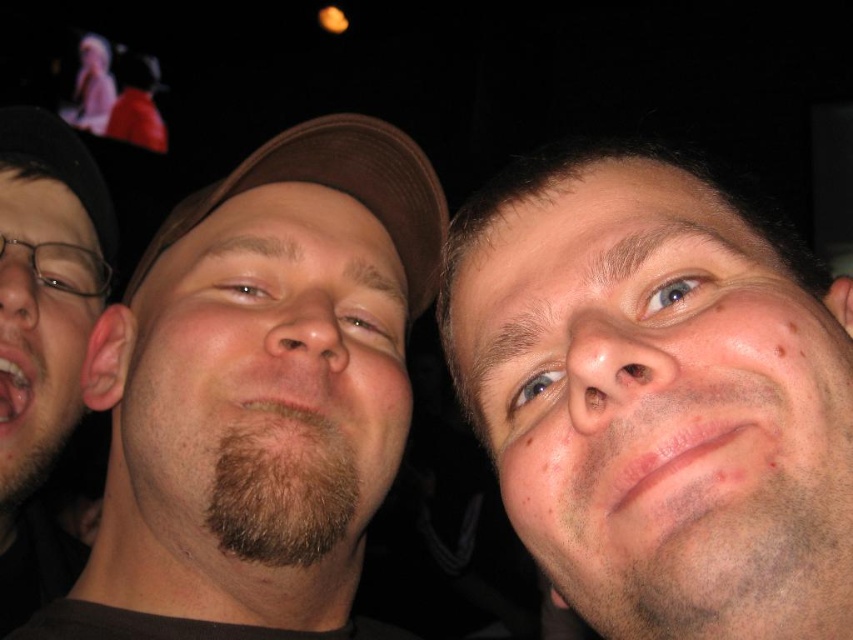
Question: Observing the image, what is the correct spatial positioning of brown matte cap at center in reference to beige matte face at left?

Choices:
 (A) right
 (B) left

Answer: (A)

Question: Can you confirm if smooth skin face at center is bigger than brown matte cap at center?

Choices:
 (A) yes
 (B) no

Answer: (B)

Question: Among these points, which one is nearest to the camera?

Choices:
 (A) (320, 168)
 (B) (718, 620)

Answer: (B)

Question: Which of the following is the farthest from the observer?

Choices:
 (A) bearded man at left
 (B) brown beard at center
 (C) beige matte face at left

Answer: (C)

Question: Which of these objects is positioned farthest from the beige matte face at left?

Choices:
 (A) bearded man at left
 (B) brown fabric baseball cap at center

Answer: (B)

Question: Can you confirm if bearded man at left is positioned below brown fabric baseball cap at center?

Choices:
 (A) yes
 (B) no

Answer: (A)